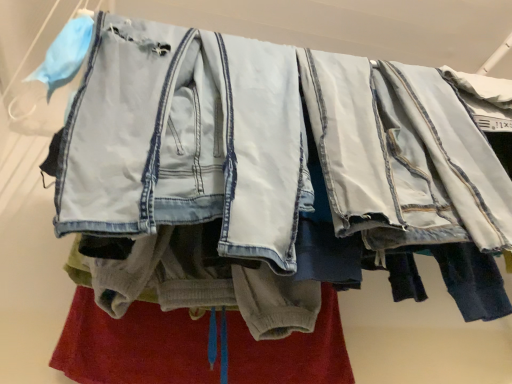
Question: Considering the relative positions of light blue denim jacket at center and soft gray fleece pants at center in the image provided, is light blue denim jacket at center in front of soft gray fleece pants at center?

Choices:
 (A) yes
 (B) no

Answer: (A)

Question: Is light blue denim jacket at center smaller than soft gray fleece pants at center?

Choices:
 (A) no
 (B) yes

Answer: (A)

Question: Would you say soft gray fleece pants at center is part of light blue denim jacket at center's contents?

Choices:
 (A) no
 (B) yes

Answer: (A)

Question: Is light blue denim jacket at center positioned behind soft gray fleece pants at center?

Choices:
 (A) yes
 (B) no

Answer: (B)

Question: From the image's perspective, is light blue denim jacket at center on top of soft gray fleece pants at center?

Choices:
 (A) yes
 (B) no

Answer: (A)

Question: Would you say light blue denim jacket at center is outside soft gray fleece pants at center?

Choices:
 (A) no
 (B) yes

Answer: (B)

Question: From the image's perspective, is soft gray fleece pants at center under light blue denim jacket at center?

Choices:
 (A) yes
 (B) no

Answer: (A)

Question: Considering the relative positions of soft gray fleece pants at center and light blue denim jacket at center in the image provided, is soft gray fleece pants at center to the right of light blue denim jacket at center from the viewer's perspective?

Choices:
 (A) yes
 (B) no

Answer: (A)

Question: Is light blue denim jacket at center completely or partially inside soft gray fleece pants at center?

Choices:
 (A) no
 (B) yes

Answer: (A)

Question: Is the depth of soft gray fleece pants at center greater than that of light blue denim jacket at center?

Choices:
 (A) no
 (B) yes

Answer: (B)

Question: From the image's perspective, does soft gray fleece pants at center appear higher than light blue denim jacket at center?

Choices:
 (A) yes
 (B) no

Answer: (B)

Question: Does soft gray fleece pants at center have a smaller size compared to light blue denim jacket at center?

Choices:
 (A) no
 (B) yes

Answer: (B)

Question: In terms of width, does soft gray fleece pants at center look wider or thinner when compared to light blue denim jacket at center?

Choices:
 (A) thin
 (B) wide

Answer: (A)